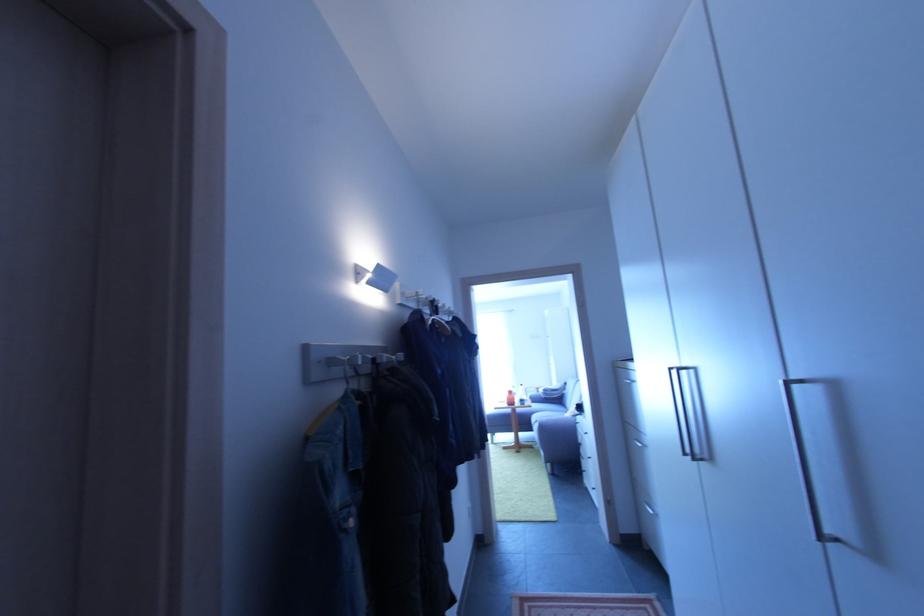
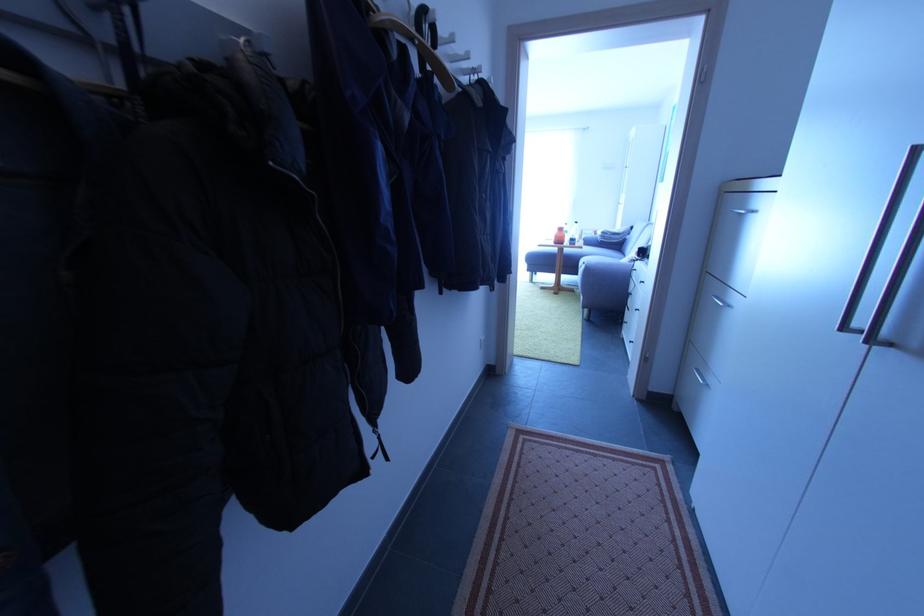
Question: The images are taken continuously from a first-person perspective. In which direction is your viewpoint rotating?

Choices:
 (A) Left
 (B) Right
 (C) Up
 (D) Down

Answer: (D)